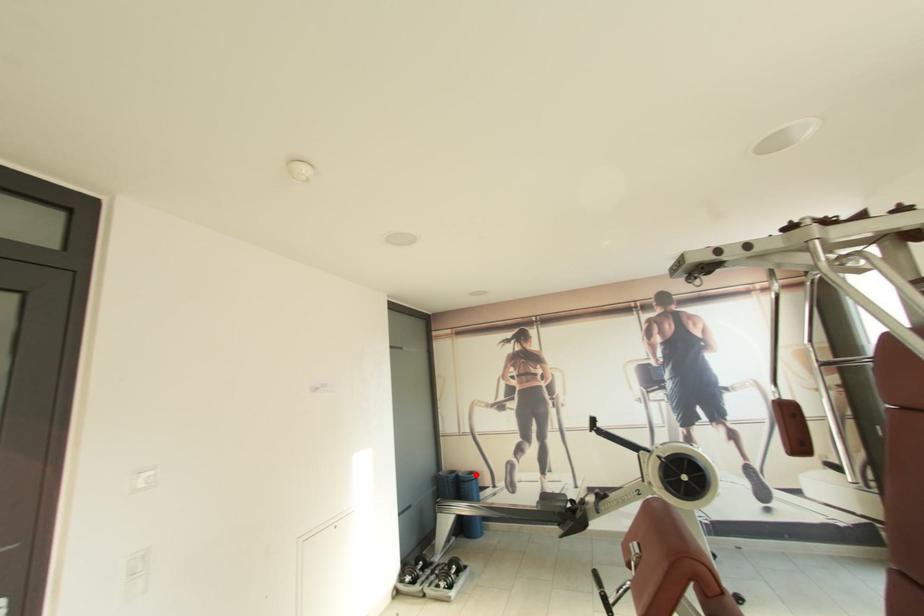
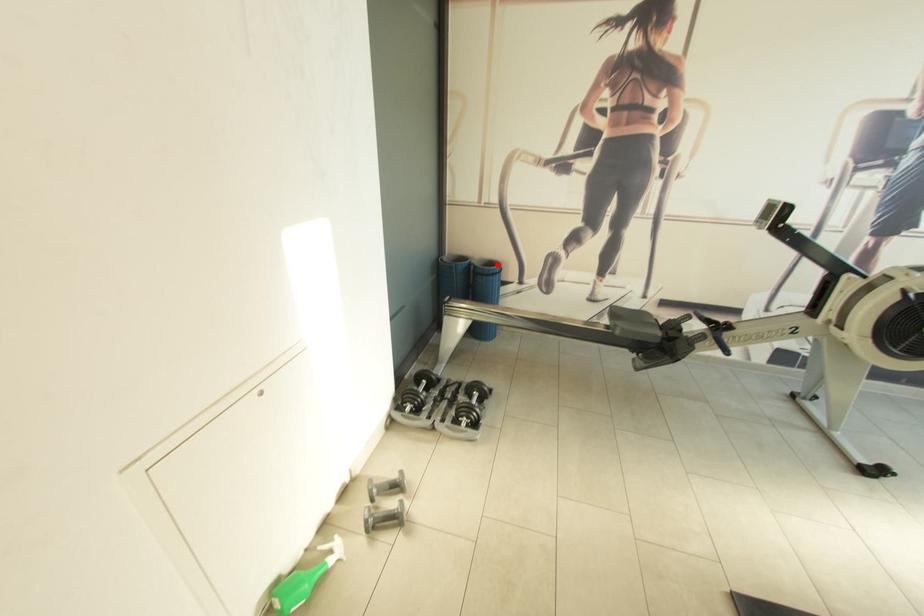
I am providing you with two images of the same scene from different viewpoints. A red point is marked on the first image and another point is marked on the second image. Does the point marked in image1 correspond to the same location as the one in image2?

Yes